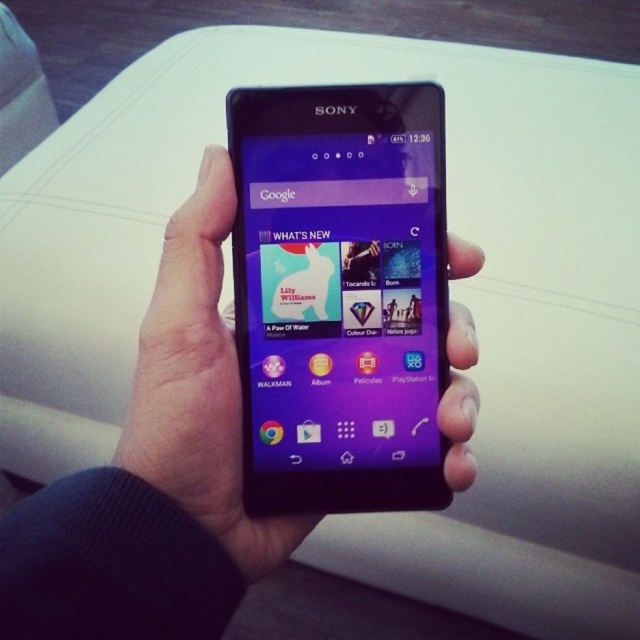
You are trying to determine which smartphone is on top in the image. You see a matte black smartphone at center and a black matte phone at center. Which one is above the other?

The matte black smartphone at center is positioned over black matte phone at center, so the matte black smartphone at center is above the black matte phone at center.

You are trying to use your phone to take a photo of the apps displayed on the screen. However, your hand is slightly shaky. Which phone, the matte black smartphone at center or the black matte phone at center, is more likely to stay in focus if you try to capture the apps in the WHATS NEW section?

The matte black smartphone at center is more likely to stay in focus because it is positioned on the right side of the black matte phone at center, placing it closer to the center of the frame where the camera typically focuses.

Based on the photo, you are a person holding a Sony smartphone with your left hand. You want to touch the screen to click the search bar labeled Google at the top. Is the point at coordinates point (340,296) on the screen the correct location to tap?

The point 0.463, 033 marks the matte black smartphone at center. The search bar labeled Google is at the top of the screen, so the coordinates point (340,296) is not the correct location to tap the search bar.